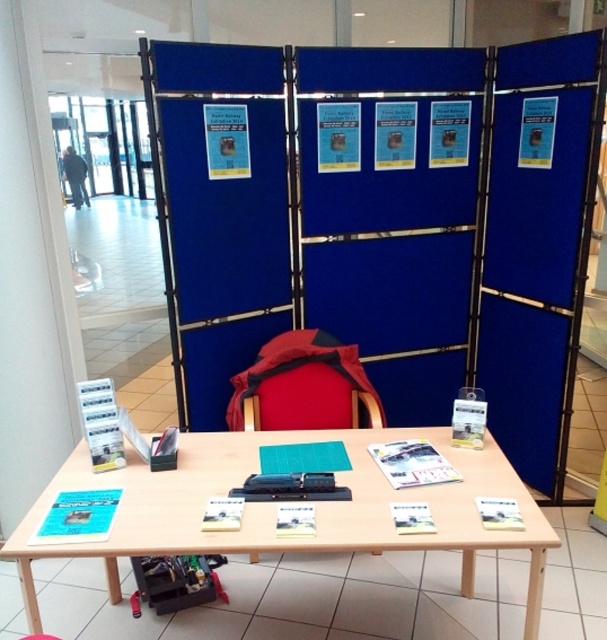
Based on the photo, can you confirm if wooden table at center is positioned above pink plastic stool at lower center?

Indeed, wooden table at center is positioned over pink plastic stool at lower center.

Does wooden table at center have a greater width compared to pink plastic stool at lower center?

Indeed, wooden table at center has a greater width compared to pink plastic stool at lower center.

Who is more distant from viewer, (x=344, y=541) or (x=42, y=637)?

Positioned behind is point (x=42, y=637).

Find the location of `wooden table at center`. wooden table at center is located at coordinates (276, 508).

Which is more to the right, red fabric chair at center or velvet-like red chair at center?

Positioned to the right is velvet-like red chair at center.

Who is higher up, red fabric chair at center or velvet-like red chair at center?

velvet-like red chair at center

Where is `red fabric chair at center`? The image size is (607, 640). red fabric chair at center is located at coordinates (304, 387).

This screenshot has height=640, width=607. I want to click on red fabric chair at center, so click(x=304, y=387).

Does point (214, 448) come farther from viewer compared to point (259, 429)?

No.

Is wooden table at center bigger than red fabric chair at center?

Correct, wooden table at center is larger in size than red fabric chair at center.

Identify the location of wooden table at center. (276, 508).

In order to click on wooden table at center in this screenshot , I will do `click(276, 508)`.